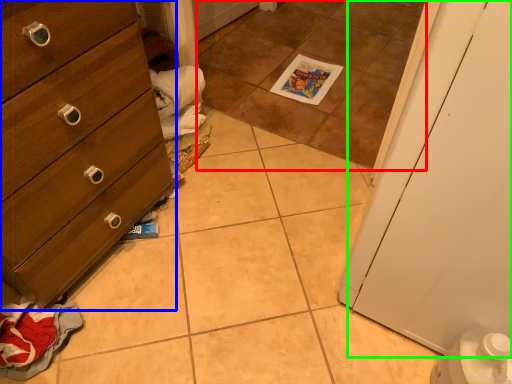
Question: Which object is the farthest from tile (highlighted by a red box)? Choose among these: chest of drawers (highlighted by a blue box) or door (highlighted by a green box).

Choices:
 (A) chest of drawers
 (B) door

Answer: (B)